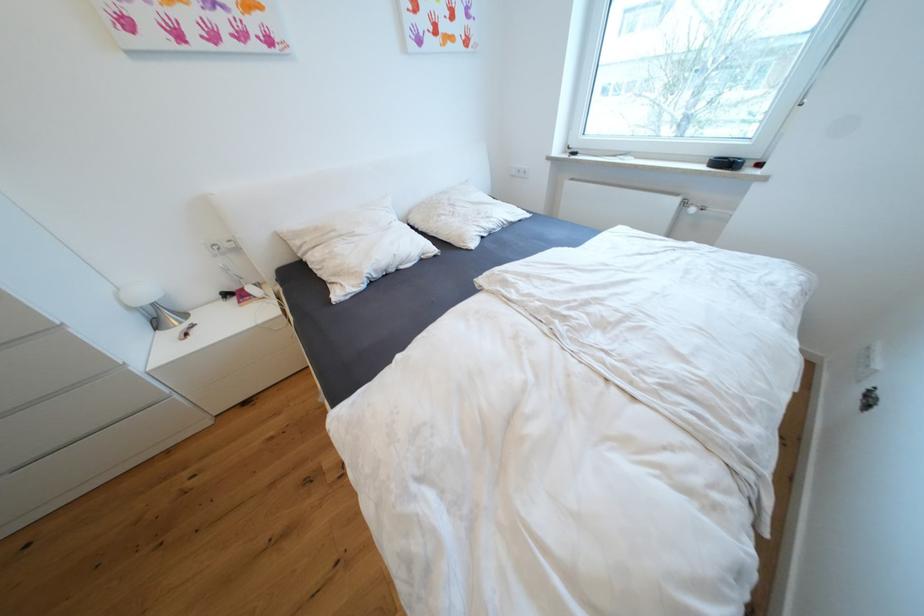
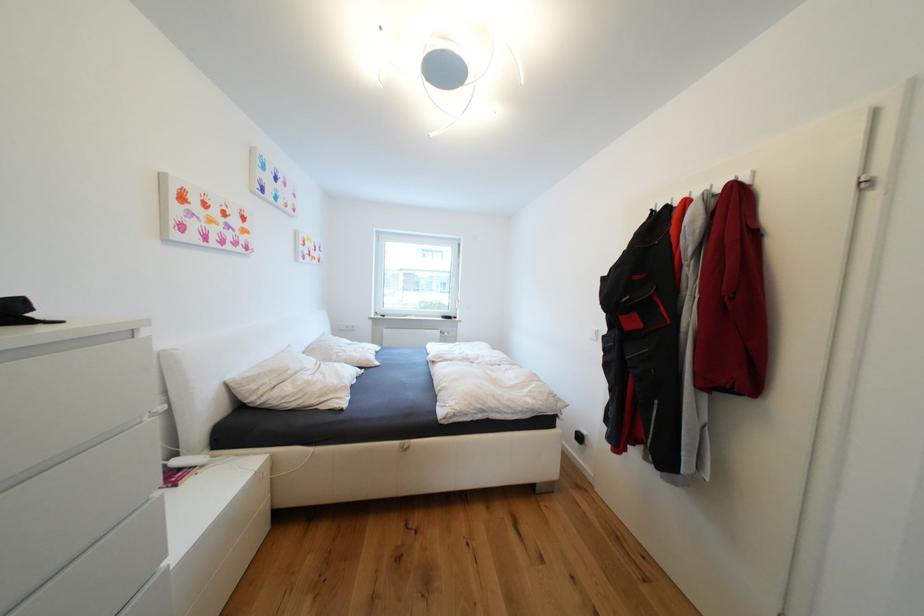
Where in the second image is the point corresponding to pixel 258 290 from the first image?

(184, 464)